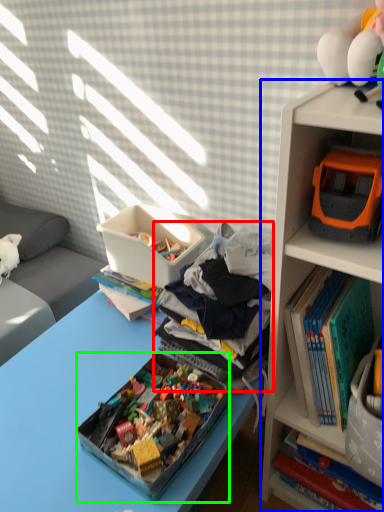
Question: Which is farther away from clothing (highlighted by a red box)? bookcase (highlighted by a blue box) or box (highlighted by a green box)?

Choices:
 (A) bookcase
 (B) box

Answer: (B)